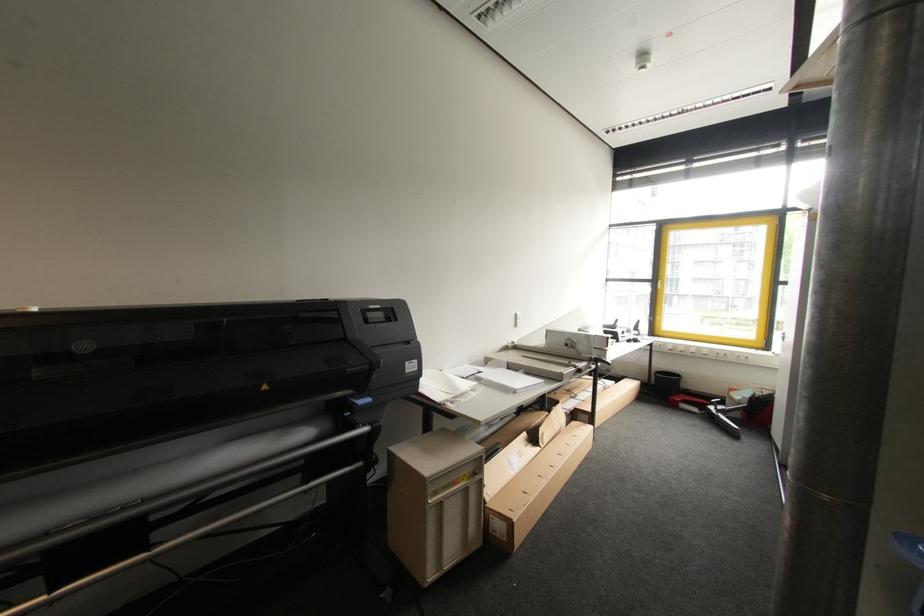
Where is `blue printer lever`? The image size is (924, 616). blue printer lever is located at coordinates click(359, 400).